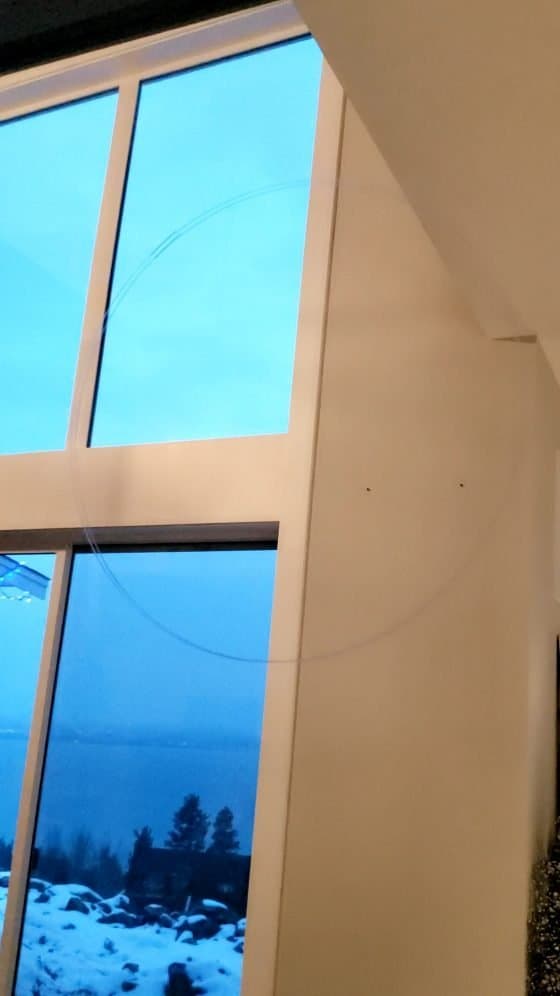
Where is `windown pane`? The width and height of the screenshot is (560, 996). windown pane is located at coordinates (182, 737), (17, 620), (24, 231), (241, 302).